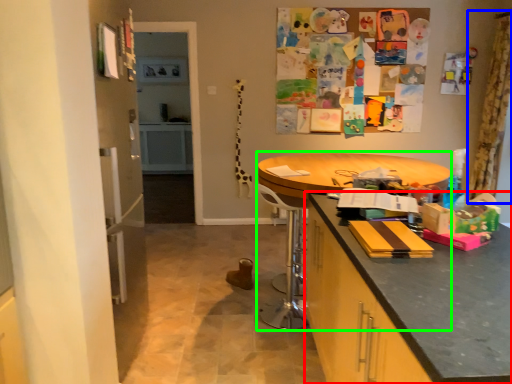
Question: Based on their relative distances, which object is farther from cabinetry (highlighted by a red box)? Choose from curtain (highlighted by a blue box) and round table (highlighted by a green box).

Choices:
 (A) curtain
 (B) round table

Answer: (A)